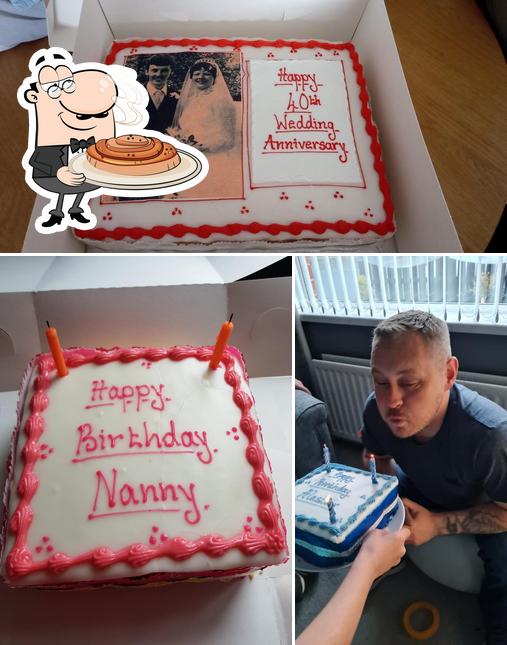
Find the location of `white cardboard cake box`. white cardboard cake box is located at coordinates (407, 131), (274, 379).